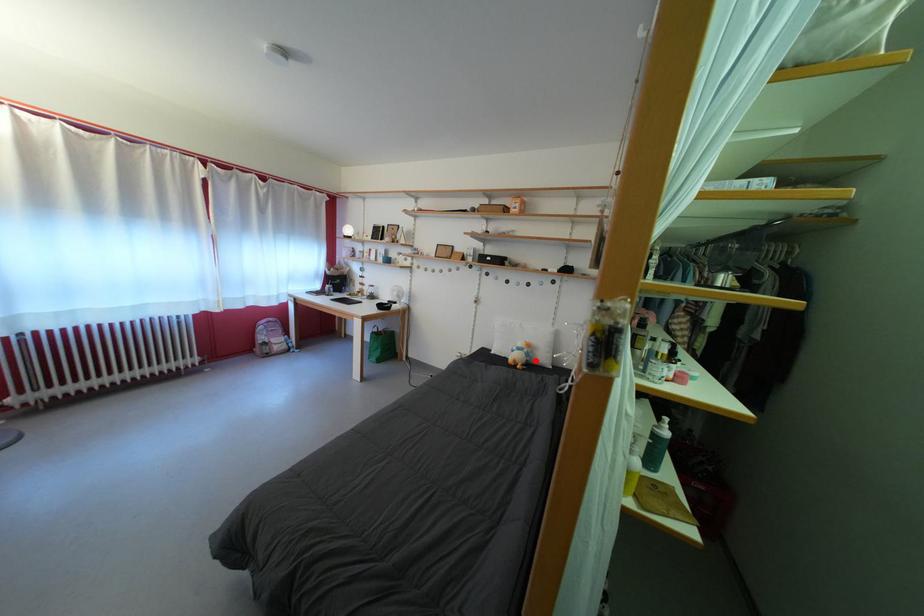
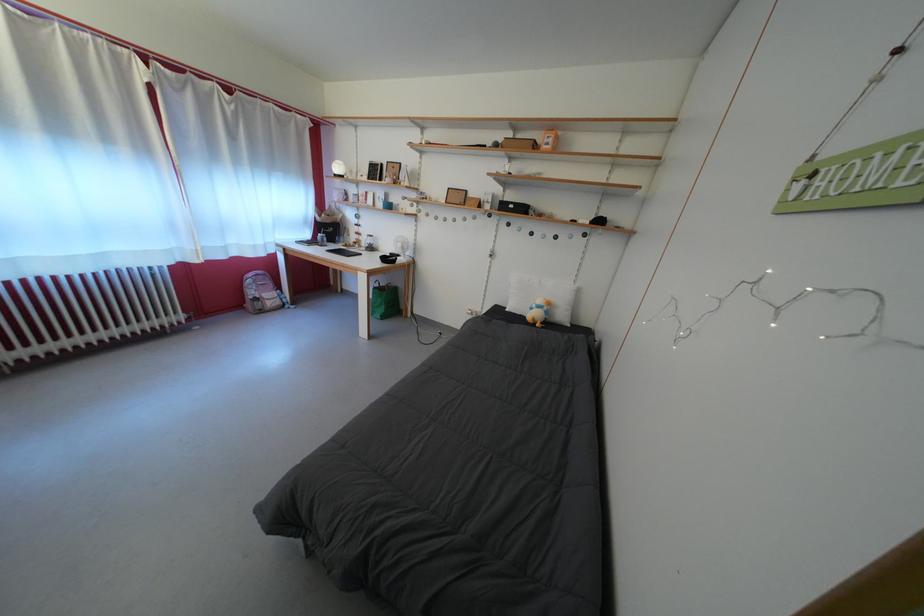
The point at the highlighted location is marked in the first image. Where is the corresponding point in the second image?

(554, 318)